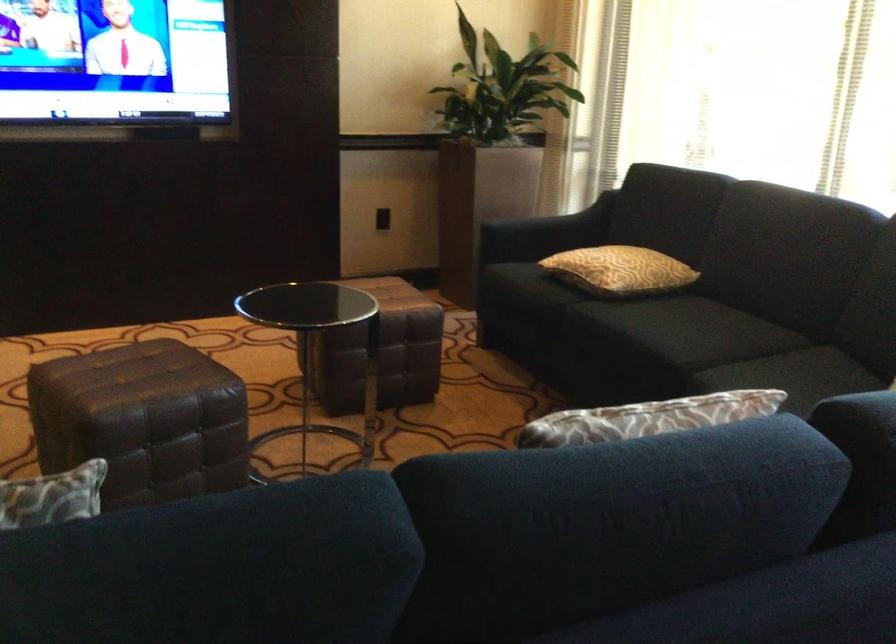
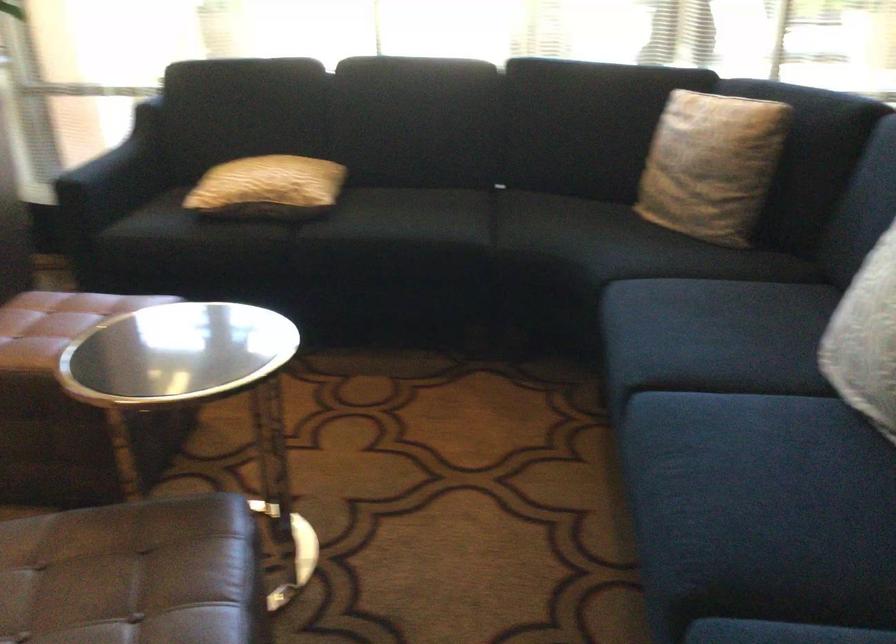
The point at (158, 381) is marked in the first image. Where is the corresponding point in the second image?

(134, 574)